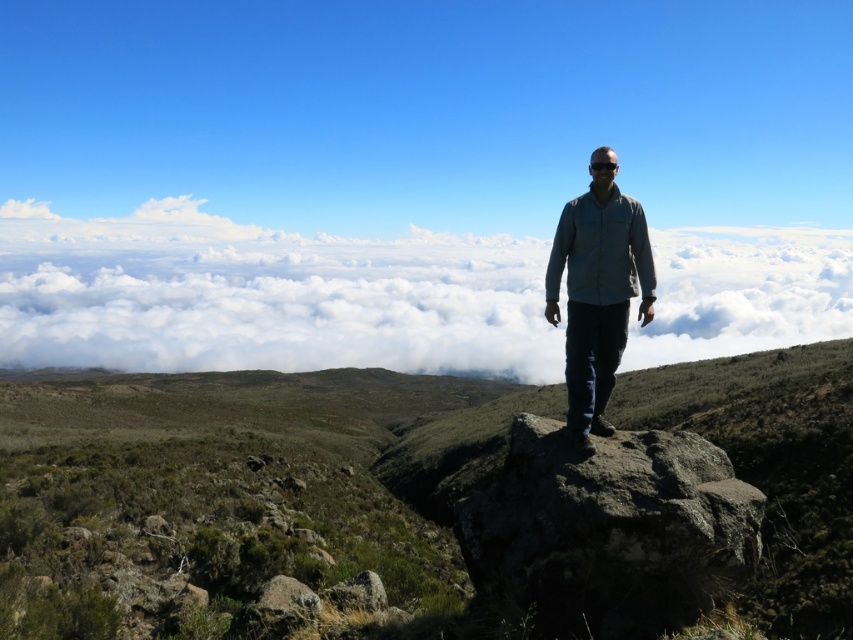
You are a hiker who wants to take a photo of the brown rocky mountain at center and the white fluffy cloud at center. Since you have a limited battery, you need to decide which object to focus on first. Based on their positions, which one should you focus on first?

You should focus on the brown rocky mountain at center first because it is closer to the viewer than the white fluffy cloud at center, so capturing it first would be more efficient before moving to the distant cloud.

You are a hiker standing at the base of the mountain. You want to take a photo of the brown rocky mountain at center from exactly 7 meters away. Is the current position where you are standing suitable for this? Please explain.

The distance of brown rocky mountain at center from camera is 6.63 meters. Since you are currently 6.63 meters away, which is less than 7 meters, you need to move back slightly to achieve the desired distance of 7 meters.